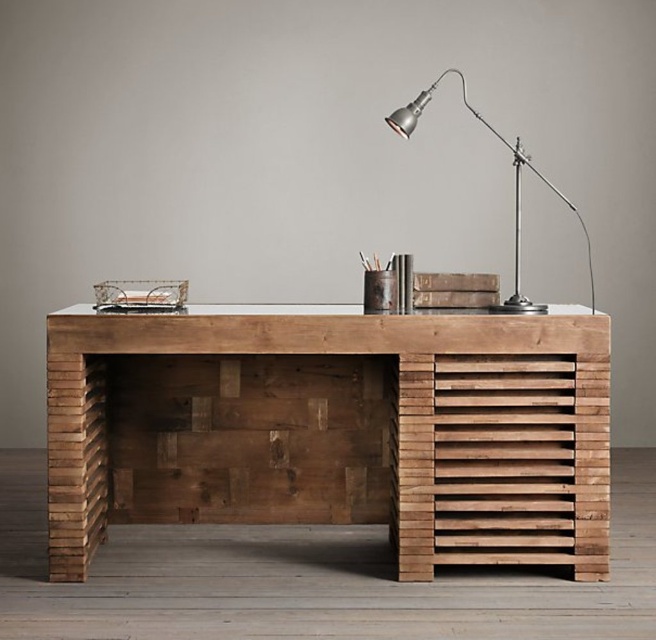
Question: Which object is farther from the camera taking this photo?

Choices:
 (A) natural wood desk at center
 (B) metallic silver desk lamp at upper right

Answer: (A)

Question: Can you confirm if natural wood desk at center is bigger than metallic silver desk lamp at upper right?

Choices:
 (A) no
 (B) yes

Answer: (A)

Question: Which point is farther to the camera?

Choices:
 (A) (514, 273)
 (B) (588, 424)

Answer: (A)

Question: Where is natural wood desk at center located in relation to metallic silver desk lamp at upper right in the image?

Choices:
 (A) left
 (B) right

Answer: (A)

Question: Is natural wood desk at center wider than metallic silver desk lamp at upper right?

Choices:
 (A) no
 (B) yes

Answer: (B)